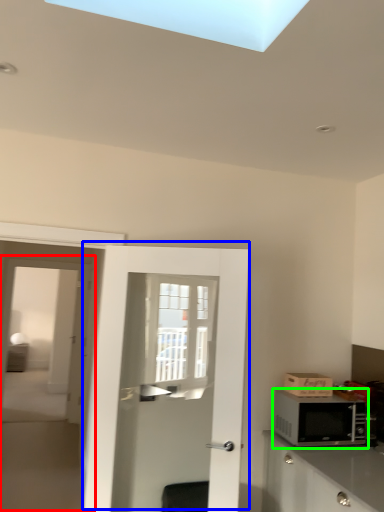
Question: Estimate the real-world distances between objects in this image. Which object is closer to screen door (highlighted by a red box), door (highlighted by a blue box) or microwave oven (highlighted by a green box)?

Choices:
 (A) door
 (B) microwave oven

Answer: (A)